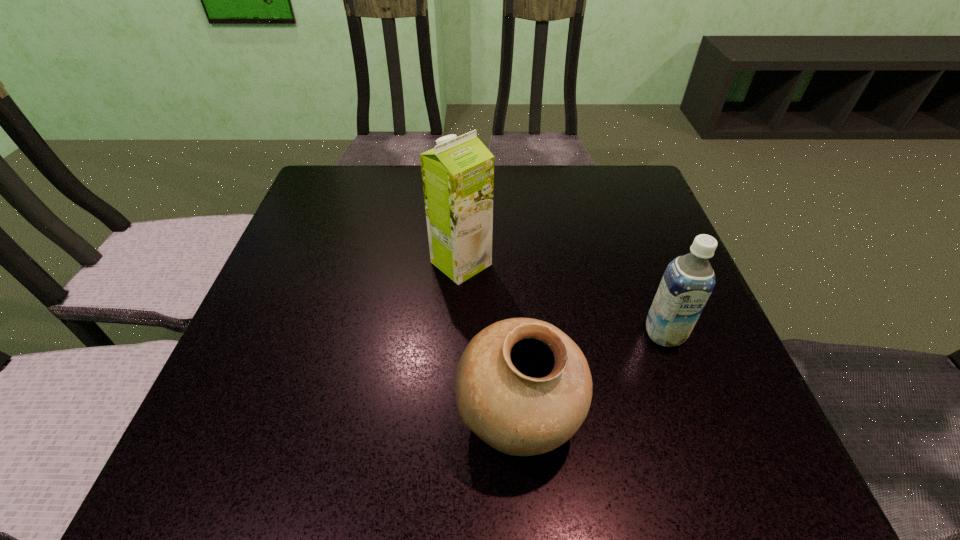
Where is `blank area at the far edge`? The image size is (960, 540). blank area at the far edge is located at coordinates (382, 166).

Where is `blank space at the near edge`? blank space at the near edge is located at coordinates (311, 462).

The height and width of the screenshot is (540, 960). Find the location of `vacant space at the left edge of the desktop`. vacant space at the left edge of the desktop is located at coordinates pos(287,356).

In order to click on blank area at the right edge in this screenshot , I will do `click(694, 345)`.

In the image, there is a desktop. At what (x,y) coordinates should I click in order to perform the action: click on vacant region at the far left corner. Please return your answer as a coordinate pair (x, y). The width and height of the screenshot is (960, 540). Looking at the image, I should click on (327, 213).

Locate an element on the screen. The width and height of the screenshot is (960, 540). vacant area at the far right corner is located at coordinates (605, 191).

Find the location of `free space at the near right corner of the desktop`. free space at the near right corner of the desktop is located at coordinates (710, 437).

Where is `vacant area that lies between the shorter soya milk and the farther soya milk`? The width and height of the screenshot is (960, 540). vacant area that lies between the shorter soya milk and the farther soya milk is located at coordinates (563, 298).

I want to click on vacant area between the rightmost object and the taller soya milk, so click(563, 298).

Image resolution: width=960 pixels, height=540 pixels. I want to click on free space between the shorter soya milk and the farther soya milk, so pos(563,298).